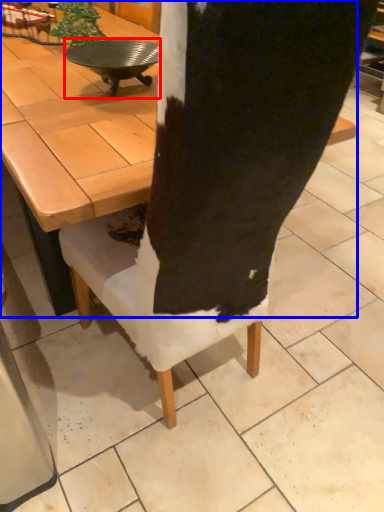
Question: Which of the following is the farthest to the observer, round table (highlighted by a red box) or coffee table (highlighted by a blue box)?

Choices:
 (A) round table
 (B) coffee table

Answer: (A)